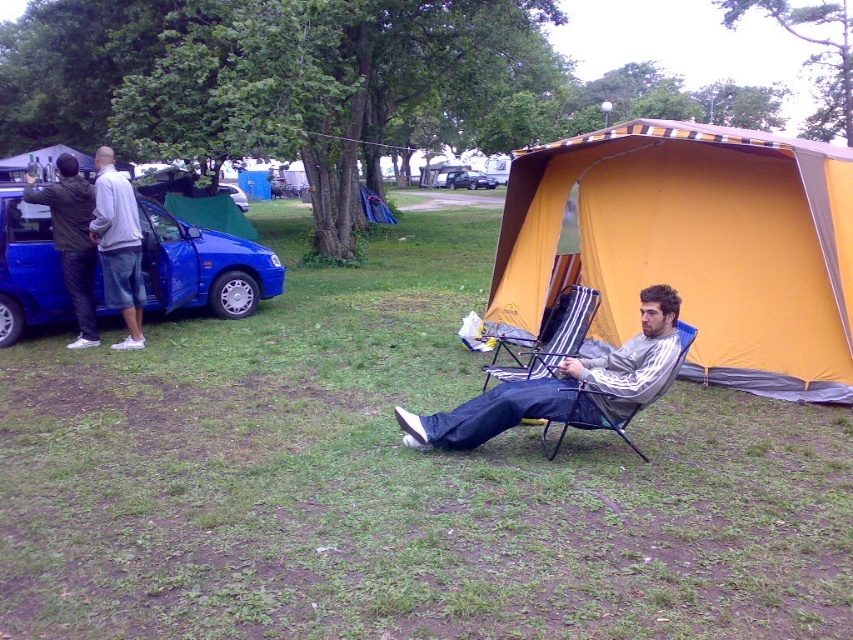
Does orange canvas tent at right have a greater height compared to metallic silver van at center?

Yes.

Is point (526, 177) less distant than point (454, 180)?

Yes, it is.

Where is `orange canvas tent at right`? This screenshot has width=853, height=640. orange canvas tent at right is located at coordinates (693, 248).

Can you confirm if blue matte car at left is bigger than dark green jacket at left?

Indeed, blue matte car at left has a larger size compared to dark green jacket at left.

Does blue matte car at left have a lesser width compared to dark green jacket at left?

Incorrect, blue matte car at left's width is not less than dark green jacket at left's.

Who is more distant from viewer, (184, 269) or (56, 200)?

The point (184, 269) is more distant.

Where is `blue matte car at left`? This screenshot has height=640, width=853. blue matte car at left is located at coordinates (202, 266).

Does orange canvas tent at right appear under gray fabric folding chair at center?

No, orange canvas tent at right is not below gray fabric folding chair at center.

At what (x,y) coordinates should I click in order to perform the action: click on orange canvas tent at right. Please return your answer as a coordinate pair (x, y). The width and height of the screenshot is (853, 640). Looking at the image, I should click on (693, 248).

Between point (775, 294) and point (682, 346), which one is positioned in front?

Point (682, 346)

Locate an element on the screen. This screenshot has height=640, width=853. orange canvas tent at right is located at coordinates (693, 248).